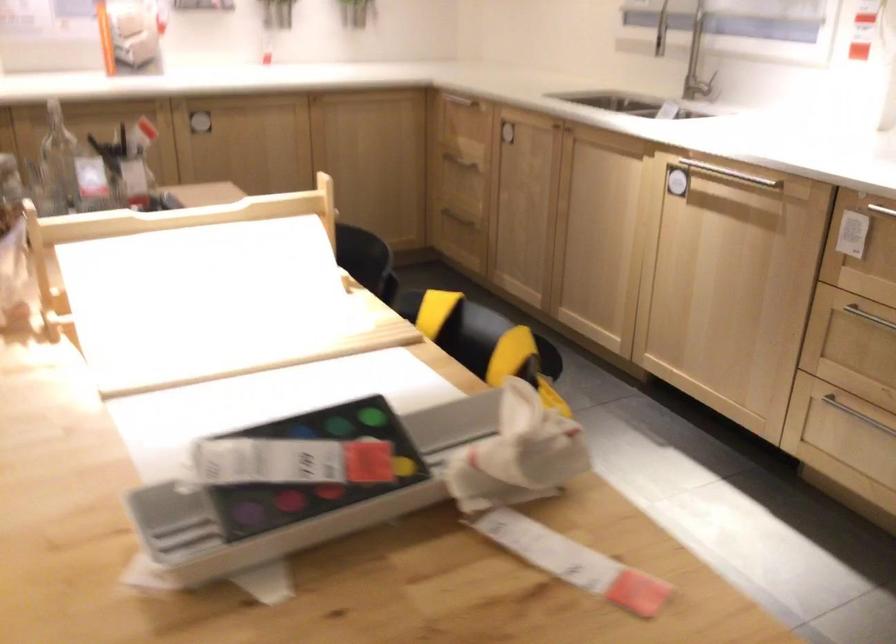
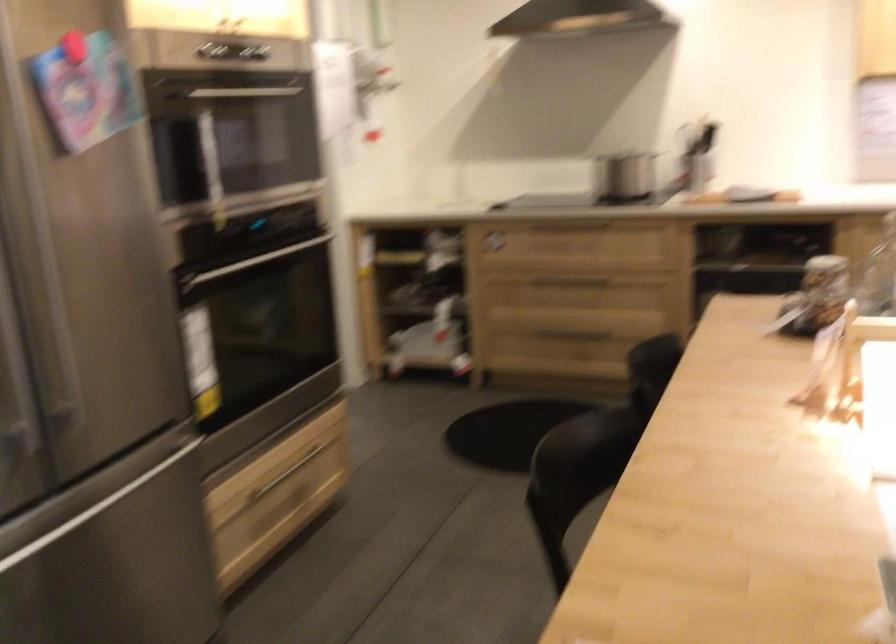
Question: The camera is either moving clockwise (left) or counter-clockwise (right) around the object. The first image is from the beginning of the video and the second image is from the end. Is the camera moving left or right when shooting the video?

Choices:
 (A) Left
 (B) Right

Answer: (B)